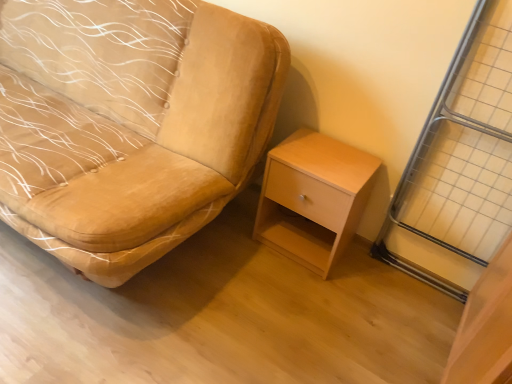
At what (x,y) coordinates should I click in order to perform the action: click on vacant area that lies between light wood/finely finished nightstand at lower right and metallic silver screen door at right. Please return your answer as a coordinate pair (x, y). This screenshot has width=512, height=384. Looking at the image, I should click on (381, 285).